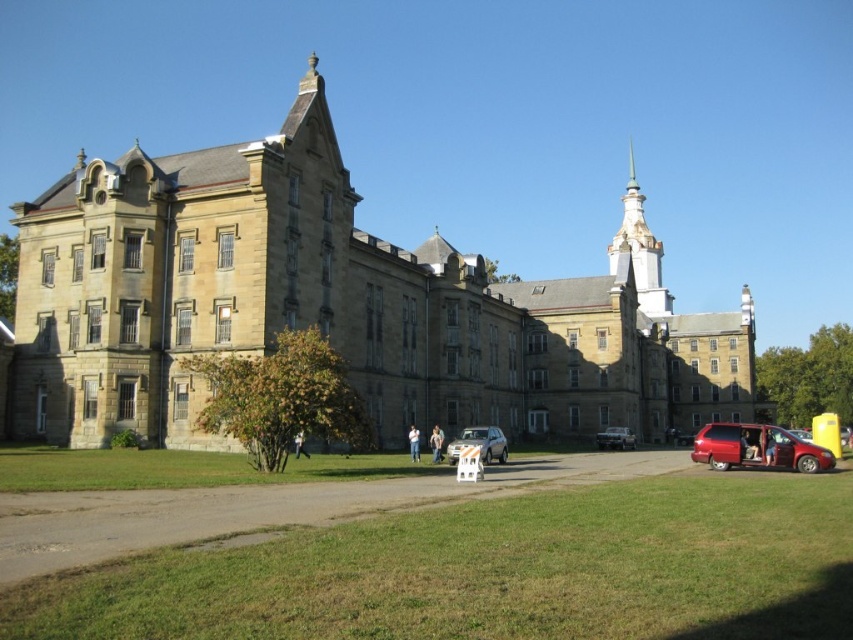
Is point (202, 616) farther from viewer compared to point (299, 445)?

No, (202, 616) is in front of (299, 445).

What do you see at coordinates (495, 572) in the screenshot? I see `green grass at lower center` at bounding box center [495, 572].

Identify the location of green grass at lower center. (495, 572).

Who is more forward, (614, 429) or (303, 449)?

Point (303, 449) is more forward.

Who is lower down, matte silver sedan at center or light brown leather jacket at center?

matte silver sedan at center is below.

Is point (608, 440) behind point (294, 448)?

Yes, it is.

Where is `matte silver sedan at center`? This screenshot has height=640, width=853. matte silver sedan at center is located at coordinates (614, 438).

Between light blue jeans at center and white cotton shirt at center, which one has more height?

light blue jeans at center is taller.

Is light blue jeans at center smaller than white cotton shirt at center?

No.

Between point (440, 433) and point (416, 445), which one is positioned in front?

Point (416, 445)

You are a GUI agent. You are given a task and a screenshot of the screen. Output one action in this format:
    pyautogui.click(x=<x>, y=<y>)
    Task: Click on the light blue jeans at center
    This screenshot has height=640, width=853.
    Given the screenshot: What is the action you would take?
    pyautogui.click(x=436, y=444)